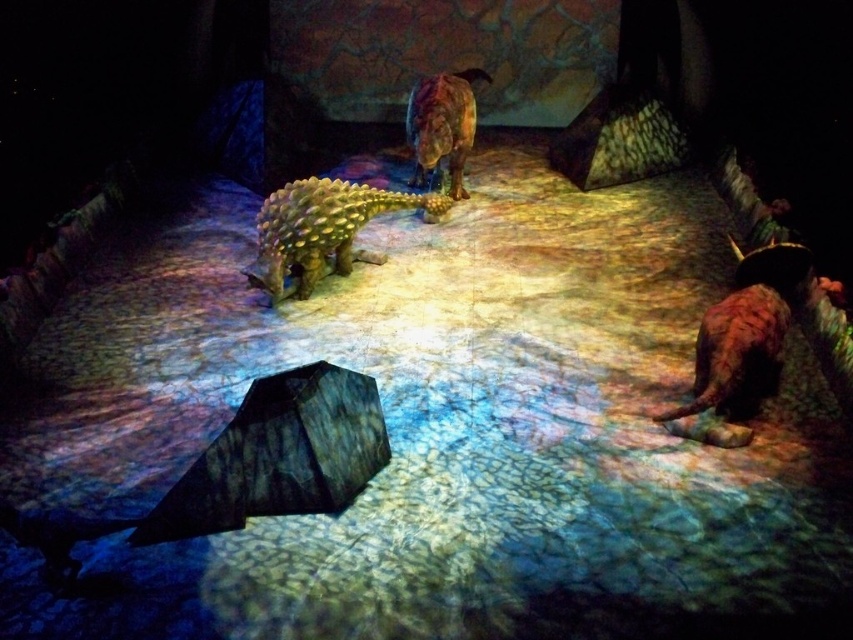
Can you confirm if green scaly ankylosaurus at center is bigger than shiny brown dinosaur at center?

Correct, green scaly ankylosaurus at center is larger in size than shiny brown dinosaur at center.

Is point (300, 244) positioned before point (430, 145)?

Yes, point (300, 244) is in front of point (430, 145).

This screenshot has height=640, width=853. What do you see at coordinates (322, 230) in the screenshot?
I see `green scaly ankylosaurus at center` at bounding box center [322, 230].

Where is `green scaly ankylosaurus at center`? green scaly ankylosaurus at center is located at coordinates (322, 230).

Can you confirm if textured dark gray umbrella at center is taller than green scaly ankylosaurus at center?

In fact, textured dark gray umbrella at center may be shorter than green scaly ankylosaurus at center.

Can you confirm if textured dark gray umbrella at center is positioned above green scaly ankylosaurus at center?

No.

What do you see at coordinates (277, 456) in the screenshot? I see `textured dark gray umbrella at center` at bounding box center [277, 456].

Where is `textured dark gray umbrella at center`? textured dark gray umbrella at center is located at coordinates (277, 456).

Is textured dark gray umbrella at center above shiny brown dinosaur at center?

No, textured dark gray umbrella at center is not above shiny brown dinosaur at center.

Does point (305, 468) lie behind point (437, 74)?

No.

Who is more distant from viewer, (198, 497) or (425, 157)?

The point (425, 157) is more distant.

Image resolution: width=853 pixels, height=640 pixels. Find the location of `textured dark gray umbrella at center`. textured dark gray umbrella at center is located at coordinates (277, 456).